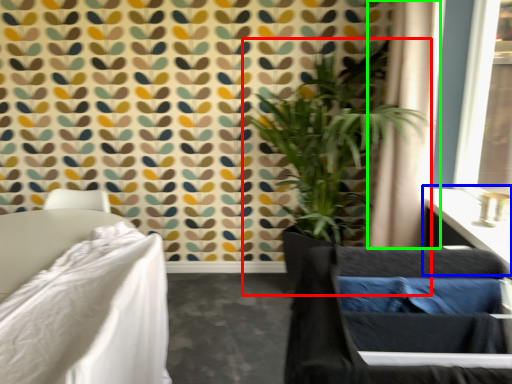
Question: Which object is positioned farthest from houseplant (highlighted by a red box)? Select from vanity (highlighted by a blue box) and curtain (highlighted by a green box).

Choices:
 (A) vanity
 (B) curtain

Answer: (A)